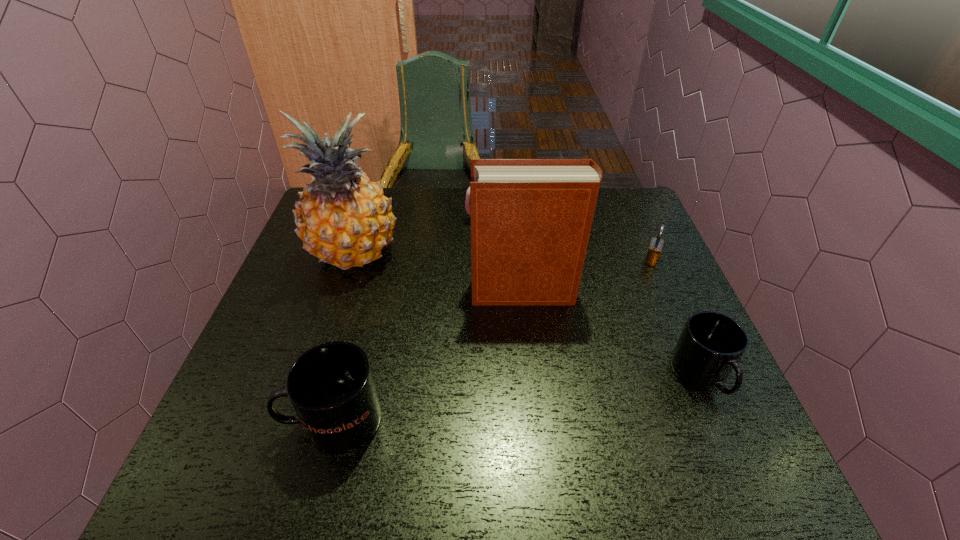
Where is `vacant spot for a new mug to ensure equal spacing`? The width and height of the screenshot is (960, 540). vacant spot for a new mug to ensure equal spacing is located at coordinates (525, 397).